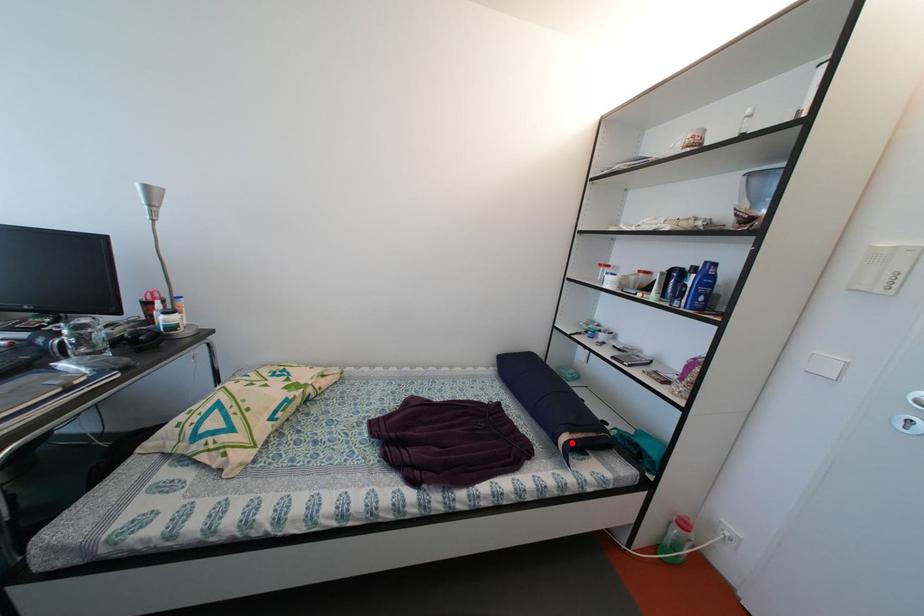
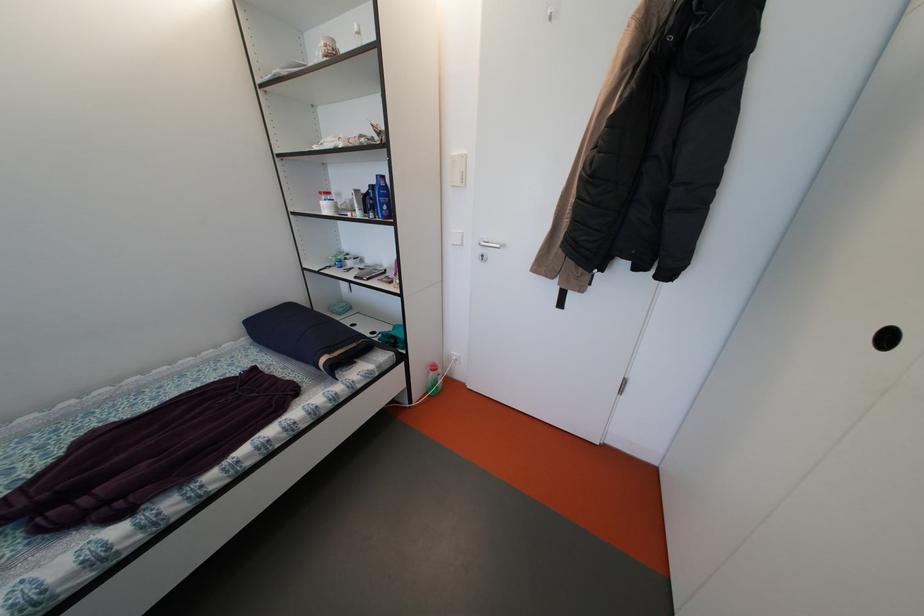
Find the pixel in the second image that matches the highlighted location in the first image.

(331, 365)